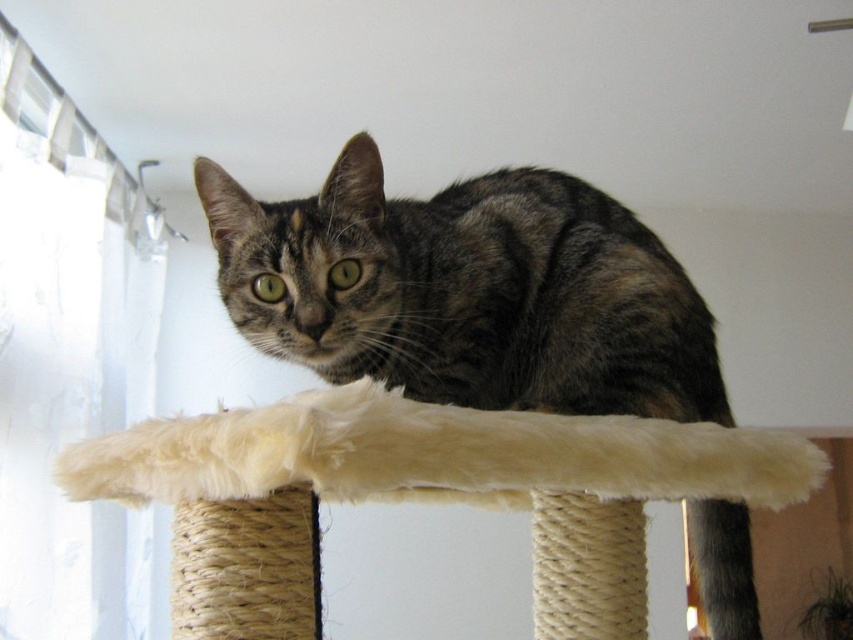
You are a cat owner who wants to place a new toy on the cat tree. The toy is 10 cm tall. If you want to place it where the tabby fur cat at center is currently sitting, will the toy be visible from below the white fluffy cat bed at center?

The tabby fur cat at center is located above the white fluffy cat bed at center, so placing the toy where the cat is sitting would place it above the bed. Since the toy is only 10 cm tall, it would still be visible from below the white fluffy cat bed at center as it is elevated.

You are a pet owner who wants to ensure the tabby fur cat at center has enough space to move on the white fluffy cat bed at center. Based on their sizes, can the cat comfortably fit on the bed?

The tabby fur cat at center is narrower than the white fluffy cat bed at center, so it can comfortably fit on the bed with space to move around.

You are a cat owner who wants to place a new toy on the white fluffy cat bed at center. Since the tabby fur cat at center is currently sitting on the bed, can you see the bed from your current position?

The white fluffy cat bed at center is behind the tabby fur cat at center, so you cannot see the bed from your current position because the cat is blocking it.